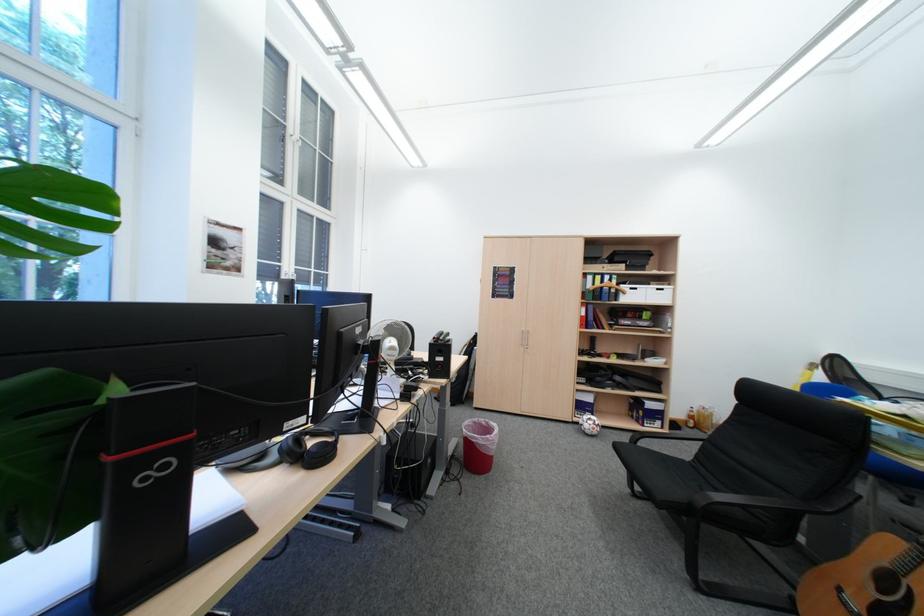
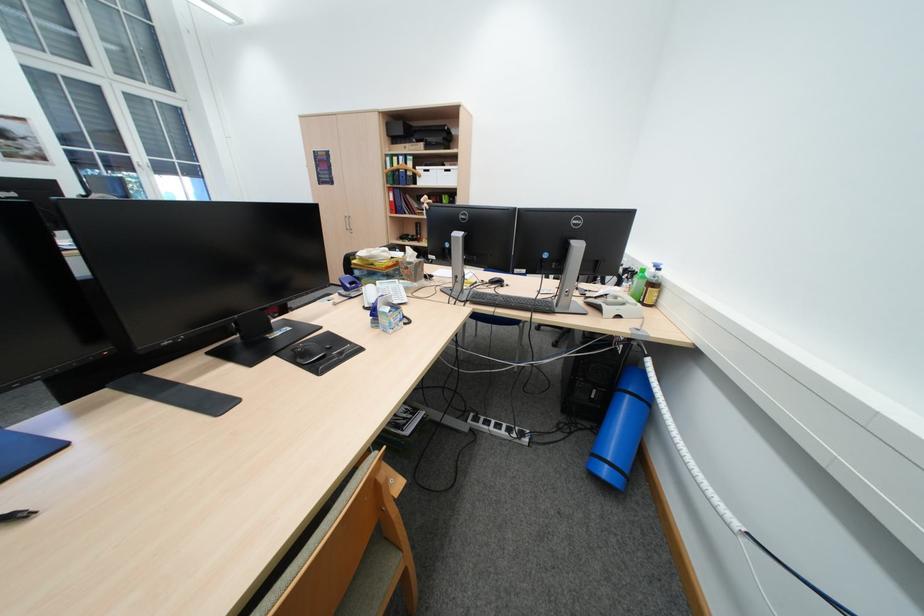
The point at (614,276) is marked in the first image. Where is the corresponding point in the second image?

(409, 156)